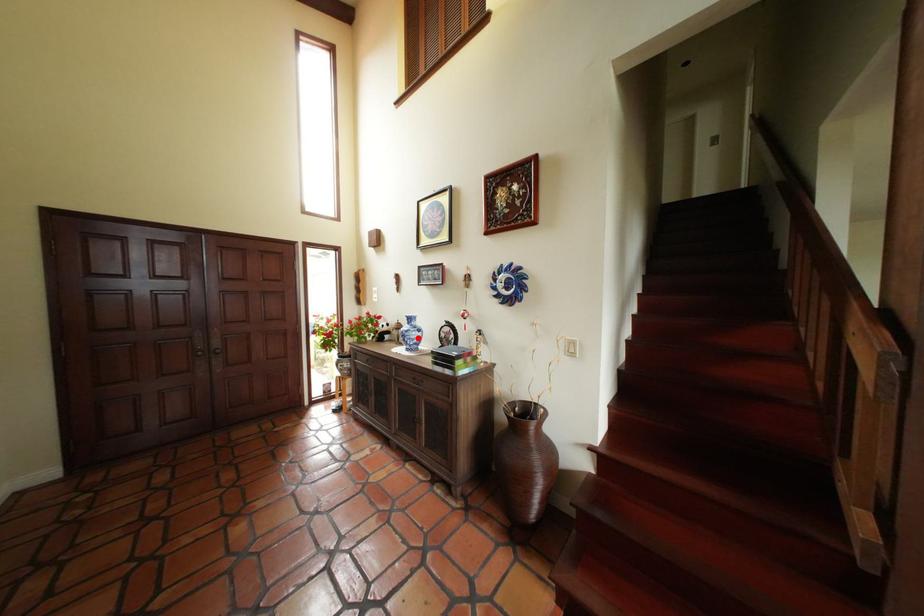
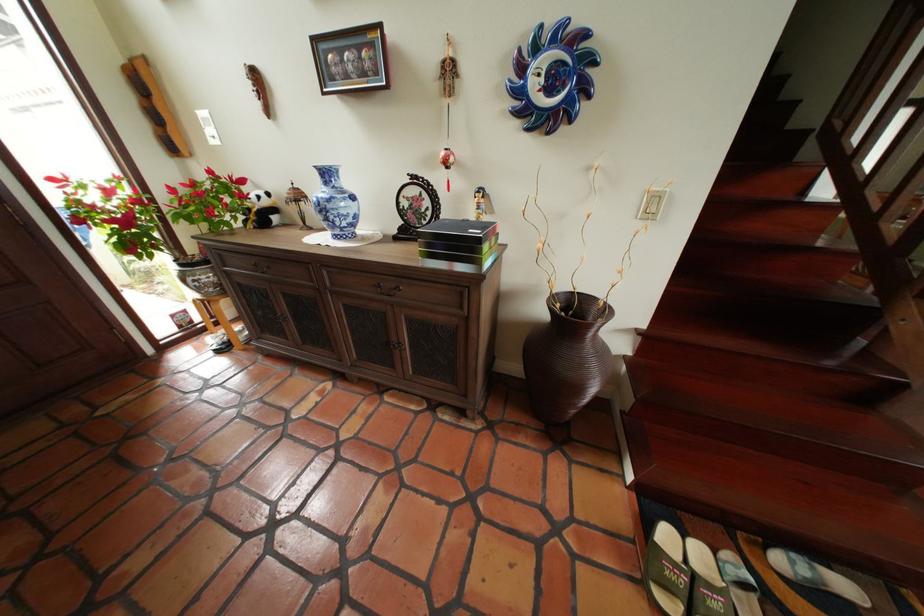
Find the pixel in the second image that matches the highlighted location in the first image.

(341, 214)